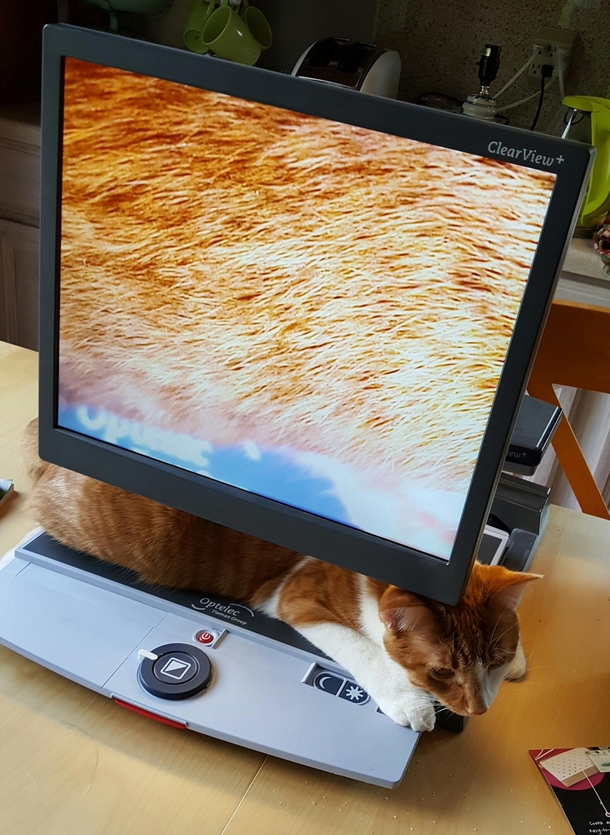
You are a GUI agent. You are given a task and a screenshot of the screen. Output one action in this format:
    pyautogui.click(x=<x>, y=<y>)
    Task: Click on the led
    
    Given the screenshot: What is the action you would take?
    [423, 190]